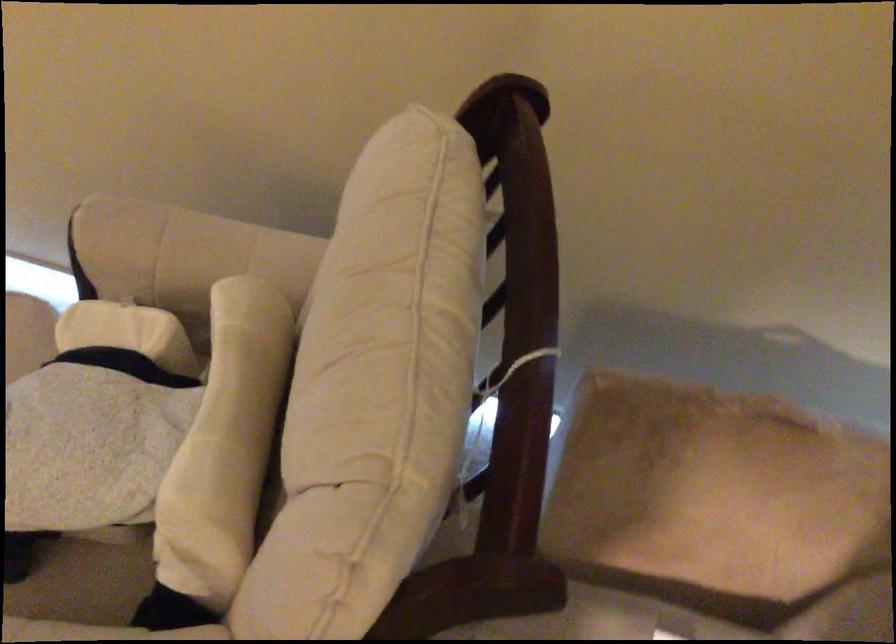
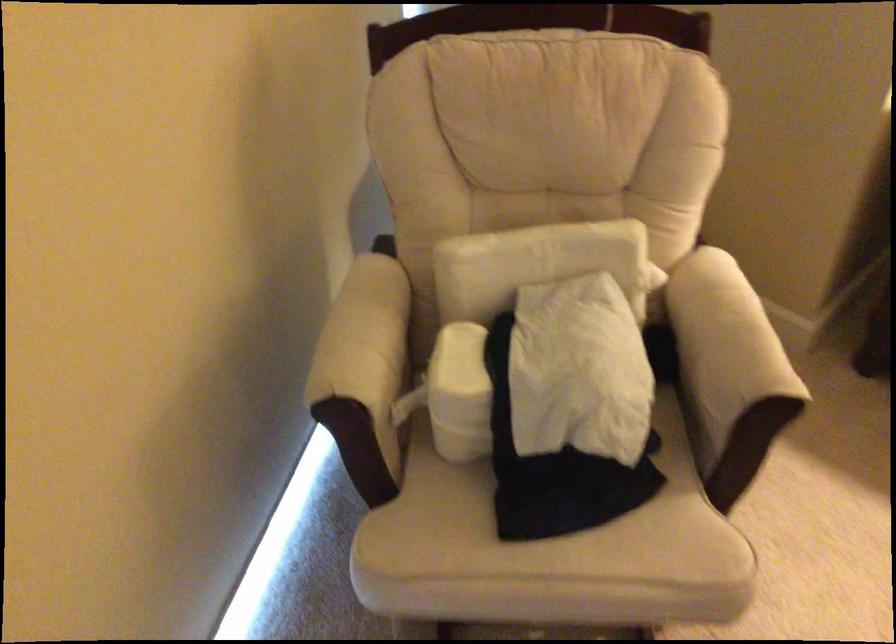
Question: I am providing you with two images of the same scene from different viewpoints. Which of the following objects are not visible in image2?

Choices:
 (A) sofa sitting surface
 (B) white back pillow
 (C) padded chair armrest
 (D) black stapler top

Answer: (A)